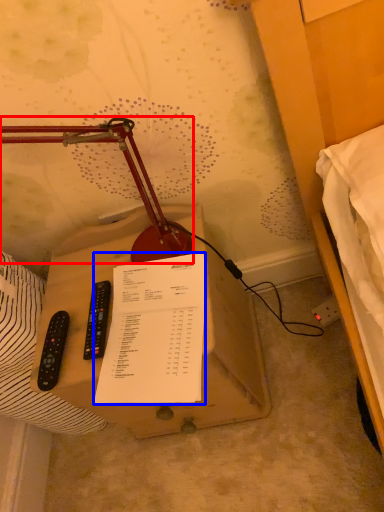
Question: Which object is closer to the camera taking this photo, lamp (highlighted by a red box) or document (highlighted by a blue box)?

Choices:
 (A) lamp
 (B) document

Answer: (A)